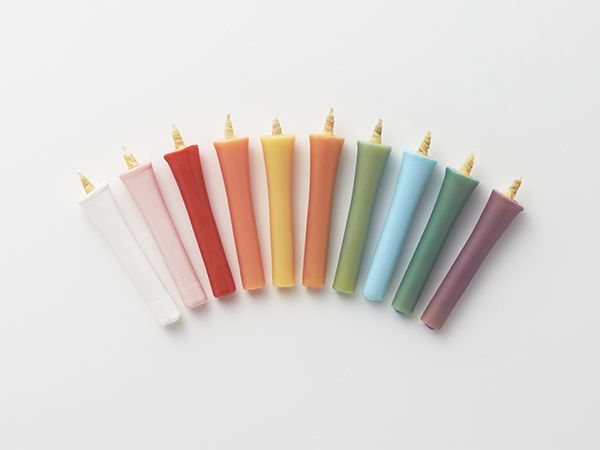
This screenshot has width=600, height=450. What are the coordinates of `candles` in the screenshot? It's located at (463, 280), (424, 263), (393, 244), (352, 236), (314, 224), (281, 232), (244, 230), (214, 238), (177, 253), (137, 275).